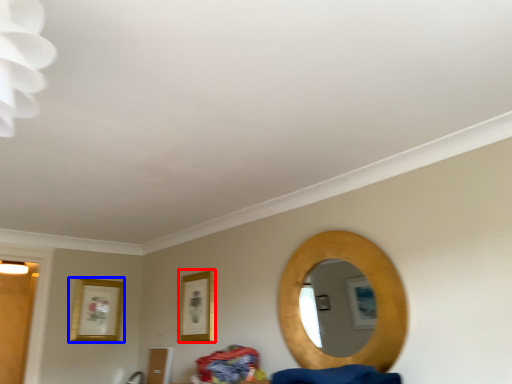
Question: Which object appears closest to the camera in this image, picture frame (highlighted by a red box) or picture frame (highlighted by a blue box)?

Choices:
 (A) picture frame
 (B) picture frame

Answer: (A)